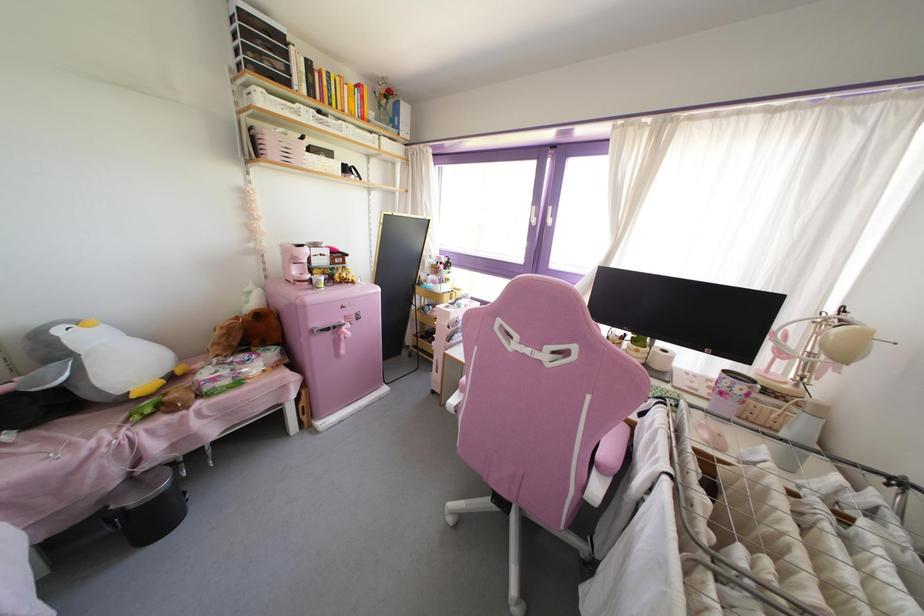
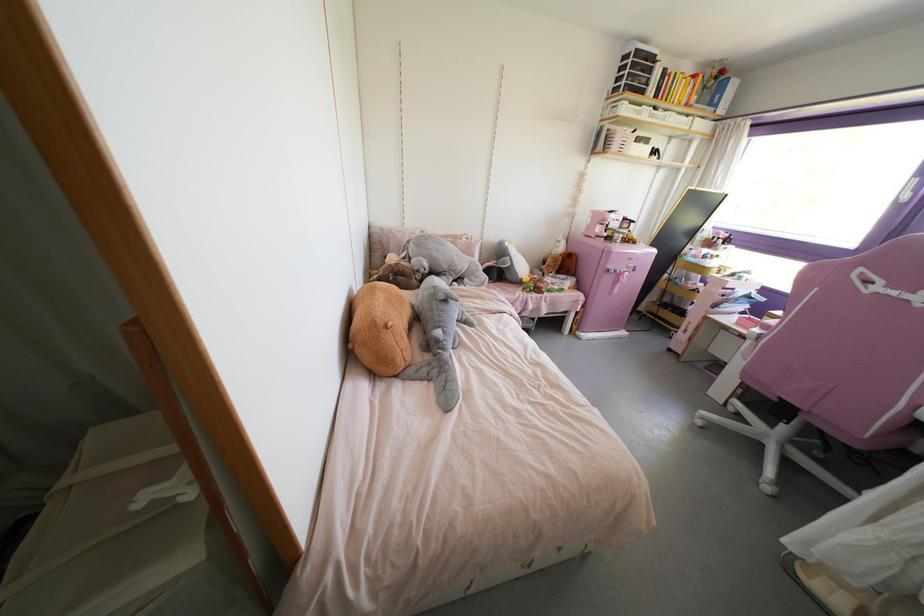
Locate, in the second image, the point that corresponds to pixel 463 390 in the first image.

(764, 326)